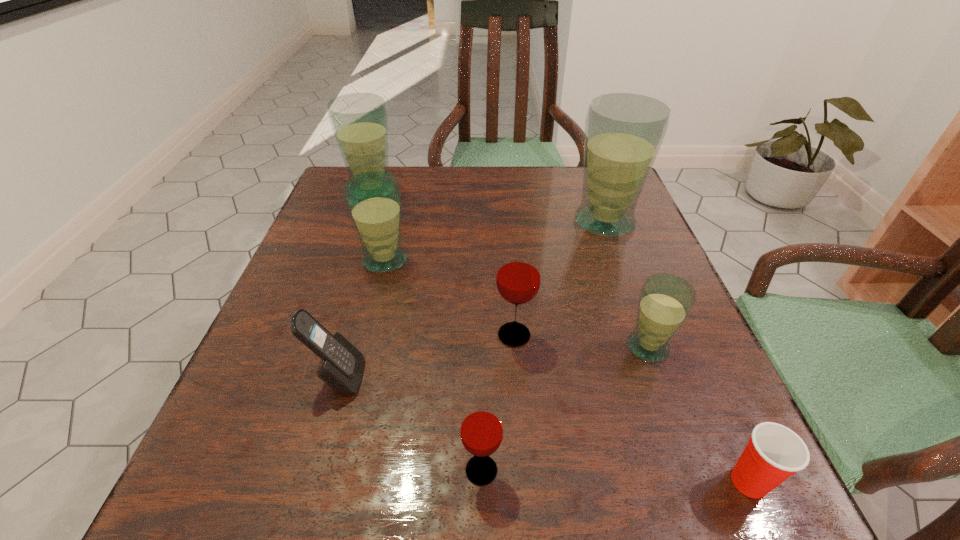
Where is `free area in between the farther red glass and the biggest blue glass`? The image size is (960, 540). free area in between the farther red glass and the biggest blue glass is located at coordinates (560, 279).

In order to click on free space between the cellular telephone and the nearer red glass in this screenshot , I will do tap(410, 424).

Where is `vacant area that lies between the Dixie cup and the second biggest blue glass`? vacant area that lies between the Dixie cup and the second biggest blue glass is located at coordinates (561, 336).

Image resolution: width=960 pixels, height=540 pixels. Find the location of `free point between the fifth shortest glass and the Dixie cup`. free point between the fifth shortest glass and the Dixie cup is located at coordinates (561, 336).

Choose which object is the seventh nearest neighbor to the tallest object. Please provide its 2D coordinates. Your answer should be formatted as a tuple, i.e. [(x, y)], where the tuple contains the x and y coordinates of a point satisfying the conditions above.

[(481, 430)]

You are a GUI agent. You are given a task and a screenshot of the screen. Output one action in this format:
    pyautogui.click(x=<x>, y=<y>)
    Task: Click on the sixth closest object to the cellular telephone
    
    Given the screenshot: What is the action you would take?
    pyautogui.click(x=623, y=131)

Where is `the closest glass relative to the nearer red glass`? This screenshot has height=540, width=960. the closest glass relative to the nearer red glass is located at coordinates (518, 277).

Image resolution: width=960 pixels, height=540 pixels. I want to click on the third closest glass to the tallest glass, so click(x=374, y=199).

This screenshot has width=960, height=540. Find the location of `blue glass that can be found as the closest to the seventh shortest object`. blue glass that can be found as the closest to the seventh shortest object is located at coordinates (374, 199).

Identify which blue glass is the third nearest to the smallest blue glass. Please provide its 2D coordinates. Your answer should be formatted as a tuple, i.e. [(x, y)], where the tuple contains the x and y coordinates of a point satisfying the conditions above.

[(359, 121)]